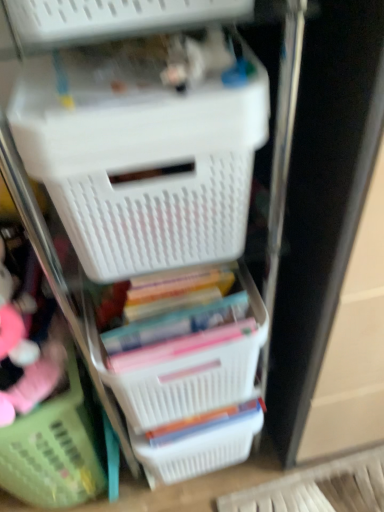
Question: Is green plastic basket at lower left, the 3th basket when ordered from right to left, facing towards white plastic basket at upper center?

Choices:
 (A) yes
 (B) no

Answer: (B)

Question: From the image's perspective, is green plastic basket at lower left, the 3th basket when ordered from right to left, under white plastic basket at upper center?

Choices:
 (A) no
 (B) yes

Answer: (B)

Question: Is green plastic basket at lower left, the 3th basket when ordered from right to left, turned away from white plastic basket at upper center?

Choices:
 (A) no
 (B) yes

Answer: (A)

Question: Are green plastic basket at lower left, the 3th basket when ordered from right to left, and white plastic basket at upper center making contact?

Choices:
 (A) no
 (B) yes

Answer: (A)

Question: Considering the relative sizes of green plastic basket at lower left, the 1th basket from the left, and white plastic basket at upper center in the image provided, is green plastic basket at lower left, the 1th basket from the left, smaller than white plastic basket at upper center?

Choices:
 (A) no
 (B) yes

Answer: (A)

Question: From a real-world perspective, is white plastic basket at center, placed as the second basket when sorted from left to right, physically below green plastic basket at lower left, the 1th basket from the left?

Choices:
 (A) no
 (B) yes

Answer: (A)

Question: Is green plastic basket at lower left, the 1th basket from the left, at the back of white plastic basket at center, placed as the second basket when sorted from left to right?

Choices:
 (A) yes
 (B) no

Answer: (B)

Question: Is green plastic basket at lower left, the 1th basket from the left, inside white plastic basket at center, which is the second basket in right-to-left order?

Choices:
 (A) yes
 (B) no

Answer: (B)

Question: Would you say white plastic basket at center, placed as the second basket when sorted from left to right, is a long distance from green plastic basket at lower left, the 3th basket when ordered from right to left?

Choices:
 (A) no
 (B) yes

Answer: (A)

Question: Is white plastic basket at center, placed as the second basket when sorted from left to right, thinner than green plastic basket at lower left, the 3th basket when ordered from right to left?

Choices:
 (A) no
 (B) yes

Answer: (B)

Question: Does white plastic basket at center, placed as the second basket when sorted from left to right, come in front of green plastic basket at lower left, the 1th basket from the left?

Choices:
 (A) no
 (B) yes

Answer: (B)

Question: Is white plastic basket at lower center, the first basket positioned from the right, oriented away from white plastic basket at center, which is the second basket in right-to-left order?

Choices:
 (A) no
 (B) yes

Answer: (A)